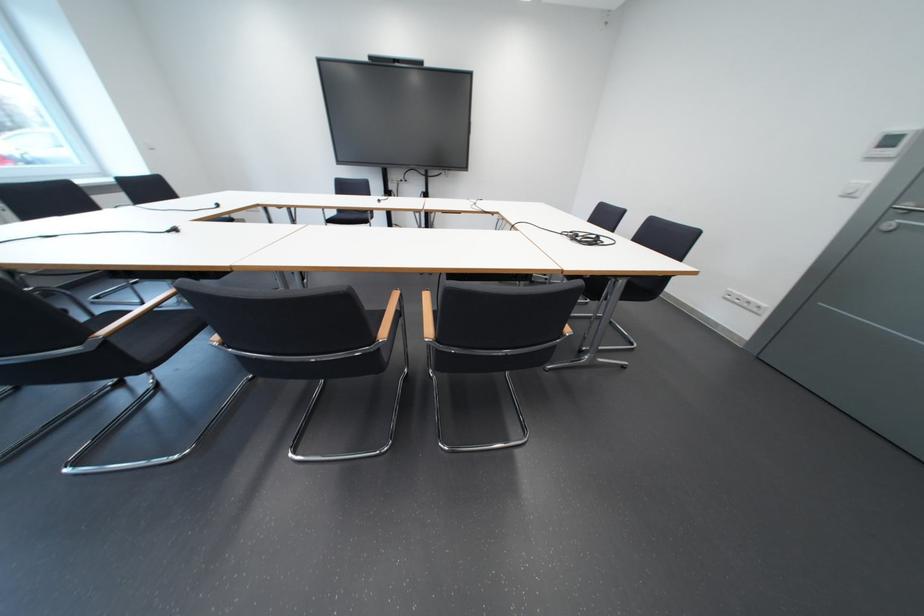
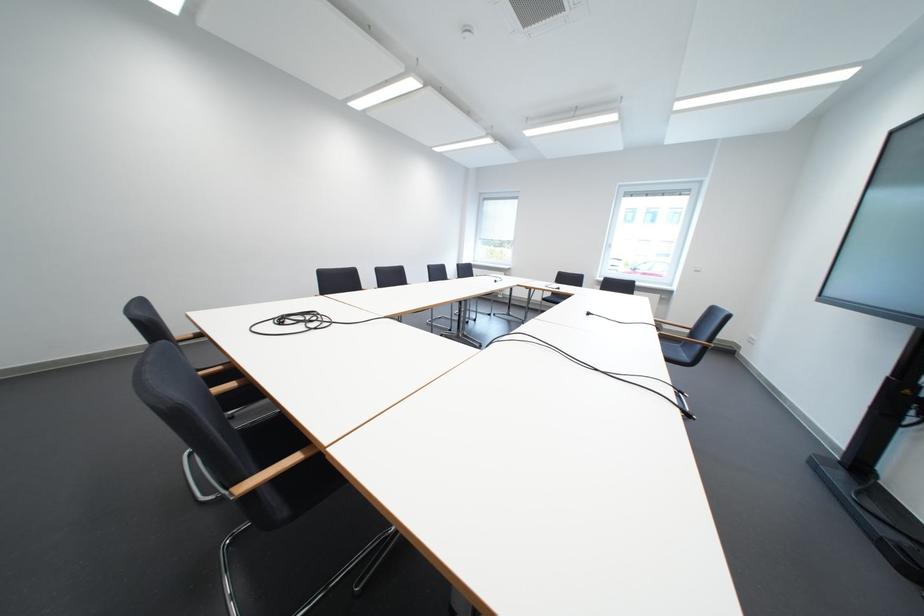
Find the pixel in the second image that matches point 391,203 in the first image.

(601, 315)